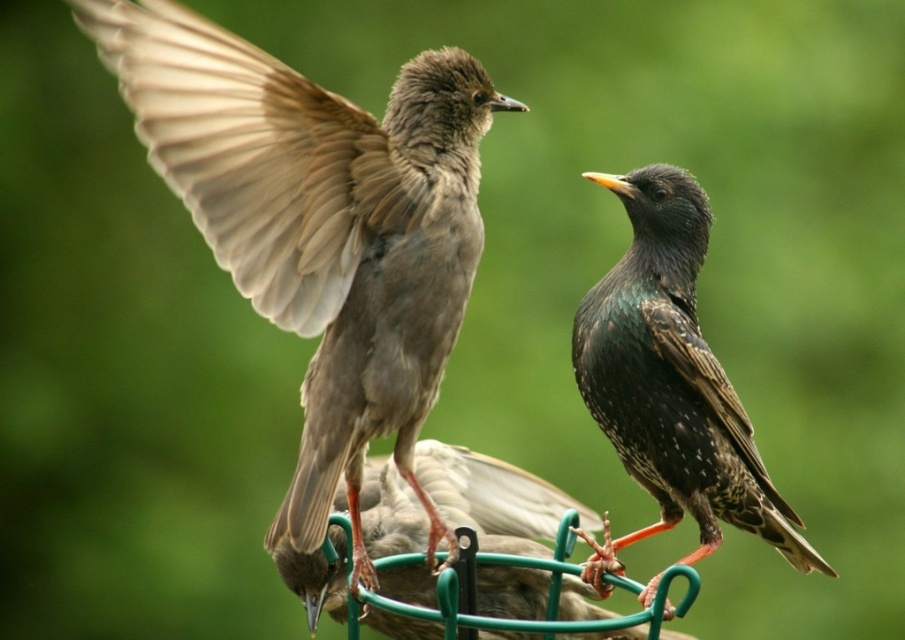
You are a birdwatcher observing the scene. You notice two birds on the feeder. The brown feathered bird at left and the shiny black bird at center. Which bird is higher up on the feeder?

The brown feathered bird at left is positioned over shiny black bird at center, so it is higher up on the feeder.

You are a birder observing two birds in a park. You see the brown feathered bird at left and the shiny black bird at center. Which bird is positioned closer to you?

The brown feathered bird at left is closer to the viewer than the shiny black bird at center.